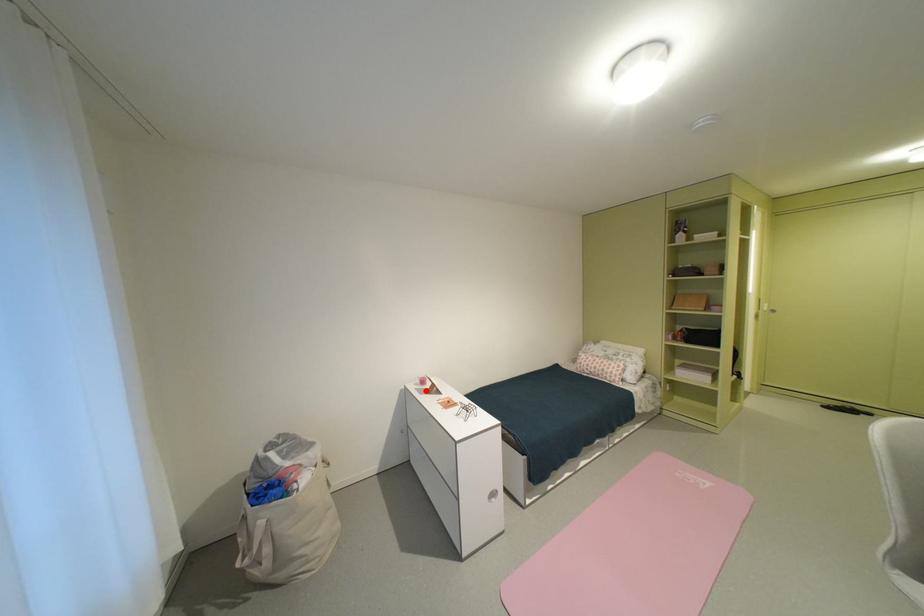
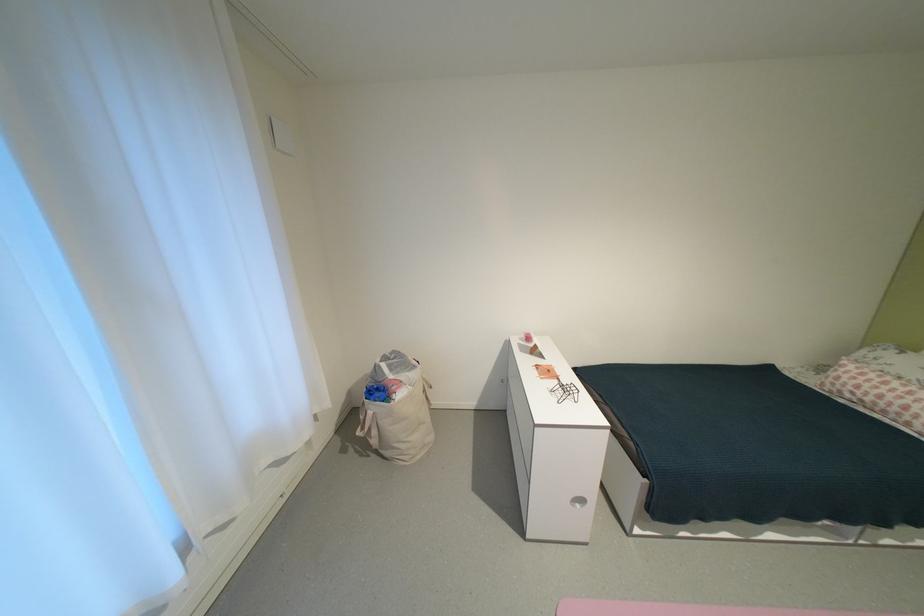
The point at the highlighted location is marked in the first image. Where is the corresponding point in the second image?

(529, 346)